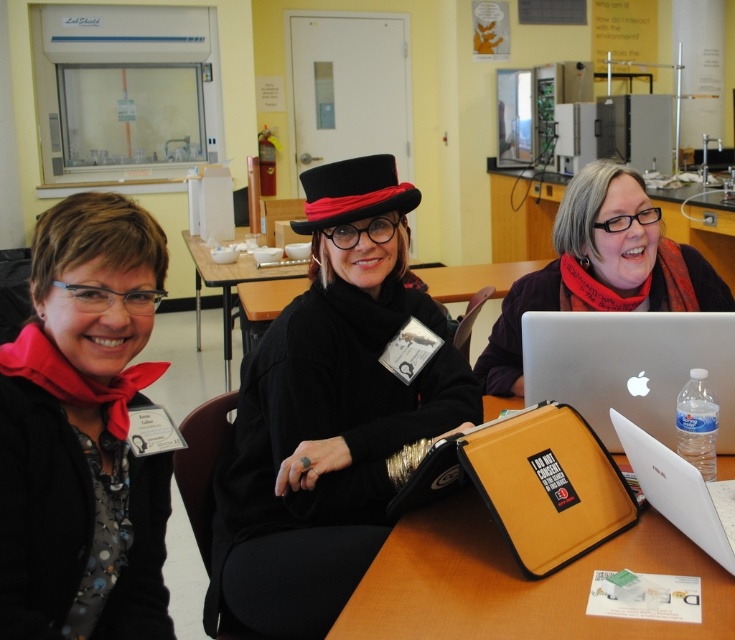
Question: Is white matte laptop at center positioned behind brown wooden table at center?

Choices:
 (A) no
 (B) yes

Answer: (A)

Question: Which point appears farthest from the camera in this image?

Choices:
 (A) (312, 228)
 (B) (662, 305)

Answer: (B)

Question: Does matte black laptop at center appear on the left side of black felt hat at center?

Choices:
 (A) no
 (B) yes

Answer: (A)

Question: Can you confirm if yellow fabric bag at center is thinner than matte black laptop at center?

Choices:
 (A) no
 (B) yes

Answer: (A)

Question: Among these objects, which one is nearest to the camera?

Choices:
 (A) black matte hat at center
 (B) brown wooden table at center
 (C) matte black laptop at center

Answer: (A)

Question: Which of the following is the farthest from the observer?

Choices:
 (A) white matte laptop at center
 (B) brown wooden table at center

Answer: (B)